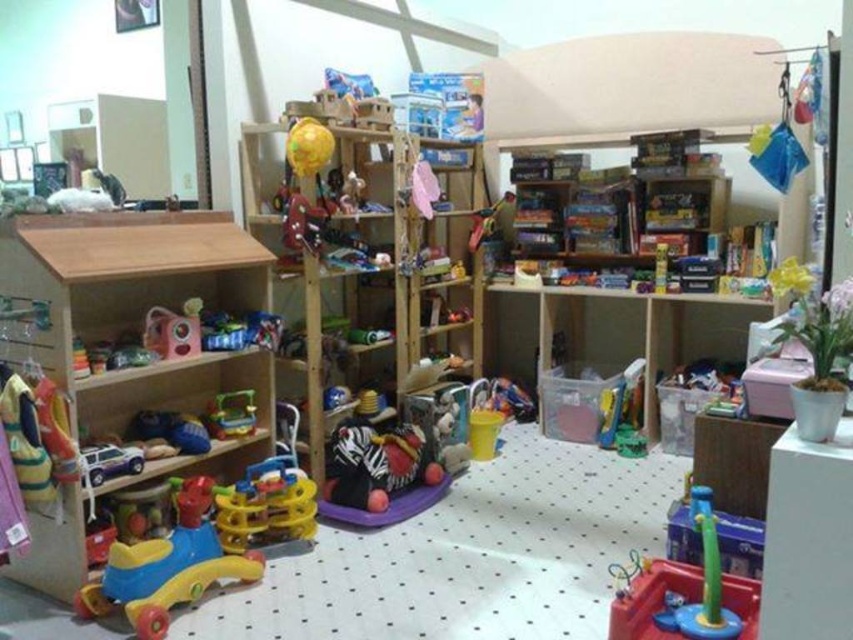
You are a parent looking for a toy for your child. You see the translucent plastic toy at lower right and the rubber yellow and blue walker at lower left. Which toy is positioned to the right side of the other?

The translucent plastic toy at lower right is positioned to the right of the rubber yellow and blue walker at lower left.

You are standing in the playroom and want to reach both points. Which point, point [640,387] or point [222,420], is closer to you?

Point [640,387] is closer to you because it is further to the viewer than point [222,420].